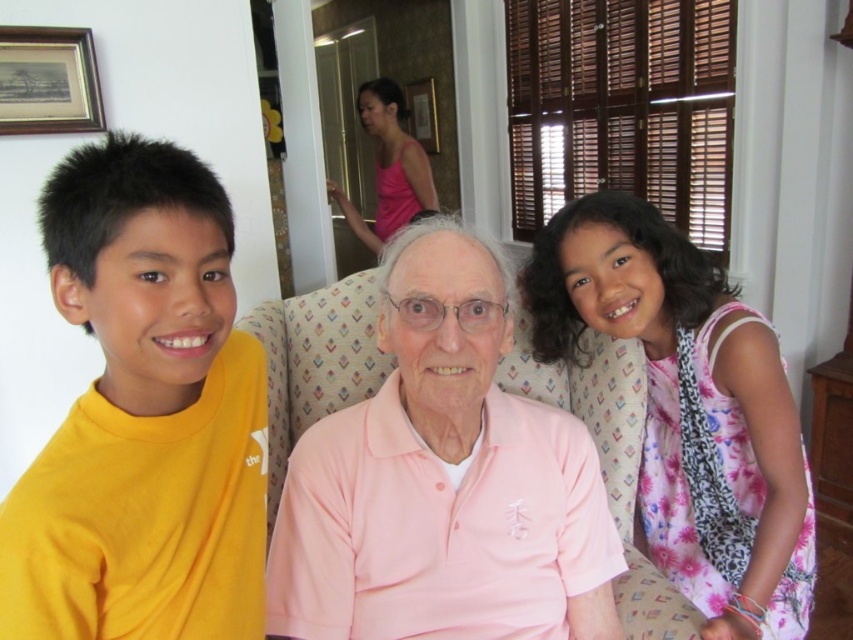
You are standing in the living room and notice two points marked in the scene. The first point is at coordinate point (148,550) and the second is at coordinate point (695,371). Which of these two points is closer to you?

The point at coordinate point (148,550) is closer to the viewer than point (695,371).

Consider the image. You are standing in the living room and want to hand a toy to the child wearing the yellow matte shirt at left. Based on the coordinates provided in the scene description, where should you walk to find this child?

The yellow matte shirt at left is located at point 0.652 on the x axis and 0.169 on the y axis. You should walk towards the coordinates (143, 417) to find the child wearing the yellow matte shirt at left.